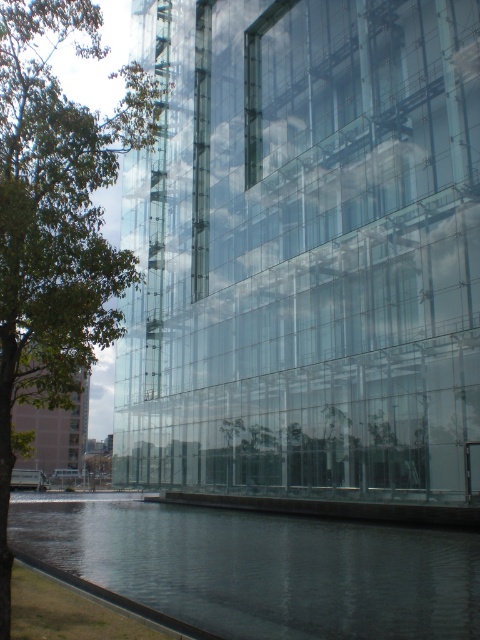
Question: Can you confirm if transparent glass water at lower left is positioned to the right of green leafy tree at left?

Choices:
 (A) yes
 (B) no

Answer: (A)

Question: Is transparent glass water at lower left wider than green leafy tree at left?

Choices:
 (A) yes
 (B) no

Answer: (A)

Question: Which of the following is the farthest from the observer?

Choices:
 (A) (96, 140)
 (B) (218, 522)

Answer: (B)

Question: Is transparent glass water at lower left thinner than green leafy tree at left?

Choices:
 (A) no
 (B) yes

Answer: (A)